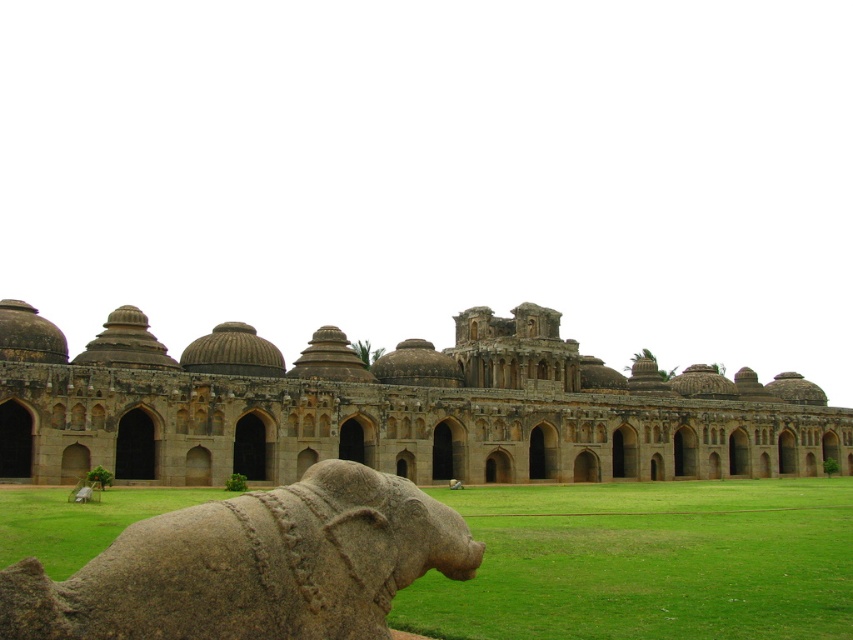
Question: Observing the image, what is the correct spatial positioning of brown stone palace at center in reference to gray stone elephant at lower left?

Choices:
 (A) left
 (B) right

Answer: (B)

Question: Observing the image, what is the correct spatial positioning of brown stone palace at center in reference to gray stone elephant at lower left?

Choices:
 (A) above
 (B) below

Answer: (A)

Question: Is brown stone palace at center in front of gray stone elephant at lower left?

Choices:
 (A) yes
 (B) no

Answer: (B)